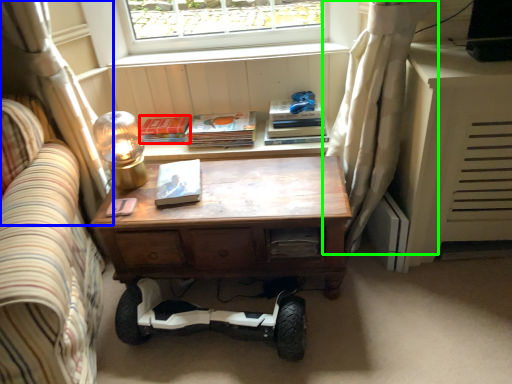
Question: Based on their relative distances, which object is farther from paperback book (highlighted by a red box)? Choose from curtain (highlighted by a blue box) and curtain (highlighted by a green box).

Choices:
 (A) curtain
 (B) curtain

Answer: (B)